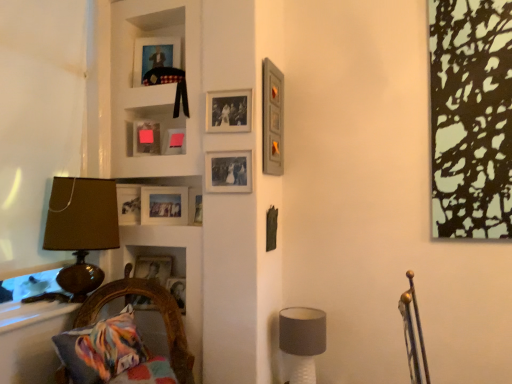
Question: Is the depth of pink matte picture frame at upper center, the 4th picture frame positioned from the bottom, less than that of matte gray picture frame at upper right, the sixth picture frame from the bottom?

Choices:
 (A) yes
 (B) no

Answer: (B)

Question: Is pink matte picture frame at upper center, the fifth picture frame when ordered from top to bottom, not near matte gray picture frame at upper right, the sixth picture frame from the bottom?

Choices:
 (A) no
 (B) yes

Answer: (A)

Question: Is pink matte picture frame at upper center, the 4th picture frame positioned from the bottom, further to camera compared to matte gray picture frame at upper right, which is the 3th picture frame in top-to-bottom order?

Choices:
 (A) no
 (B) yes

Answer: (B)

Question: From a real-world perspective, is pink matte picture frame at upper center, the 4th picture frame positioned from the bottom, physically below matte gray picture frame at upper right, which is the 3th picture frame in top-to-bottom order?

Choices:
 (A) no
 (B) yes

Answer: (B)

Question: From a real-world perspective, is pink matte picture frame at upper center, the 4th picture frame positioned from the bottom, located higher than matte gray picture frame at upper right, which is the 3th picture frame in top-to-bottom order?

Choices:
 (A) no
 (B) yes

Answer: (A)

Question: From their relative heights in the image, would you say white matte cabinet at upper left is taller or shorter than matte silver picture frame at upper center, which is counted as the 3th picture frame, starting from the bottom?

Choices:
 (A) tall
 (B) short

Answer: (A)

Question: From the image's perspective, is white matte cabinet at upper left above or below matte silver picture frame at upper center, positioned as the sixth picture frame in top-to-bottom order?

Choices:
 (A) above
 (B) below

Answer: (A)

Question: In the image, is white matte cabinet at upper left positioned in front of or behind matte silver picture frame at upper center, which is counted as the 3th picture frame, starting from the bottom?

Choices:
 (A) behind
 (B) front

Answer: (A)

Question: Looking at their shapes, would you say white matte cabinet at upper left is wider or thinner than matte silver picture frame at upper center, which is counted as the 3th picture frame, starting from the bottom?

Choices:
 (A) thin
 (B) wide

Answer: (B)

Question: From their relative heights in the image, would you say white matte cabinet at upper left is taller or shorter than brown fabric lampshade at left, placed as the second table lamp when sorted from right to left?

Choices:
 (A) tall
 (B) short

Answer: (A)

Question: Is white matte cabinet at upper left to the left or to the right of brown fabric lampshade at left, placed as the second table lamp when sorted from right to left, in the image?

Choices:
 (A) left
 (B) right

Answer: (B)

Question: Is white matte cabinet at upper left bigger or smaller than brown fabric lampshade at left, the first table lamp viewed from the left?

Choices:
 (A) big
 (B) small

Answer: (A)

Question: From the image's perspective, relative to brown fabric lampshade at left, the second table lamp when ordered from bottom to top, is white matte cabinet at upper left above or below?

Choices:
 (A) below
 (B) above

Answer: (B)

Question: Does point (238, 165) appear closer or farther from the camera than point (181, 289)?

Choices:
 (A) closer
 (B) farther

Answer: (A)

Question: In the image, is matte silver picture frame at upper center, positioned as the sixth picture frame in top-to-bottom order, positioned in front of or behind wooden picture frame at lower left, which is the first picture frame in bottom-to-top order?

Choices:
 (A) behind
 (B) front

Answer: (B)